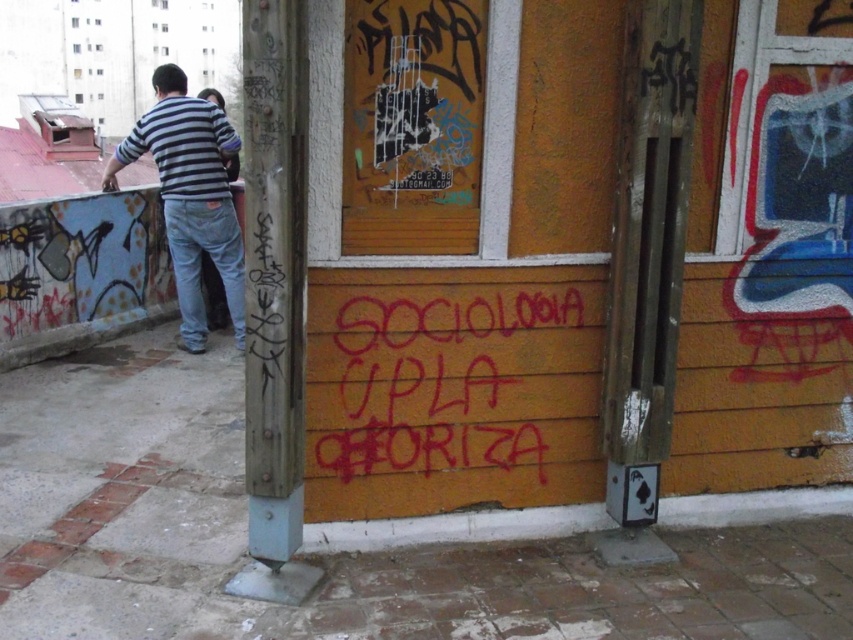
Question: Is red graffiti at center below striped cotton shirt at left?

Choices:
 (A) no
 (B) yes

Answer: (B)

Question: Which of the following is the closest to the observer?

Choices:
 (A) striped cotton shirt at left
 (B) red graffiti at center

Answer: (B)

Question: Which of the following is the closest to the observer?

Choices:
 (A) red graffiti at center
 (B) striped cotton shirt at left

Answer: (A)

Question: Is red graffiti at center bigger than striped cotton shirt at left?

Choices:
 (A) yes
 (B) no

Answer: (B)

Question: Is red graffiti at center to the right of striped cotton shirt at left from the viewer's perspective?

Choices:
 (A) yes
 (B) no

Answer: (A)